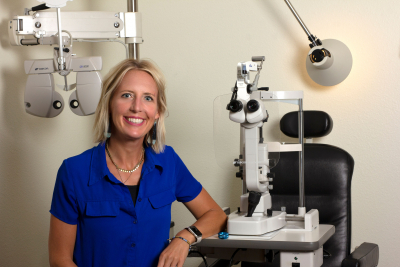
This screenshot has height=267, width=400. Find the location of `back of black leather seat`. back of black leather seat is located at coordinates (341, 177).